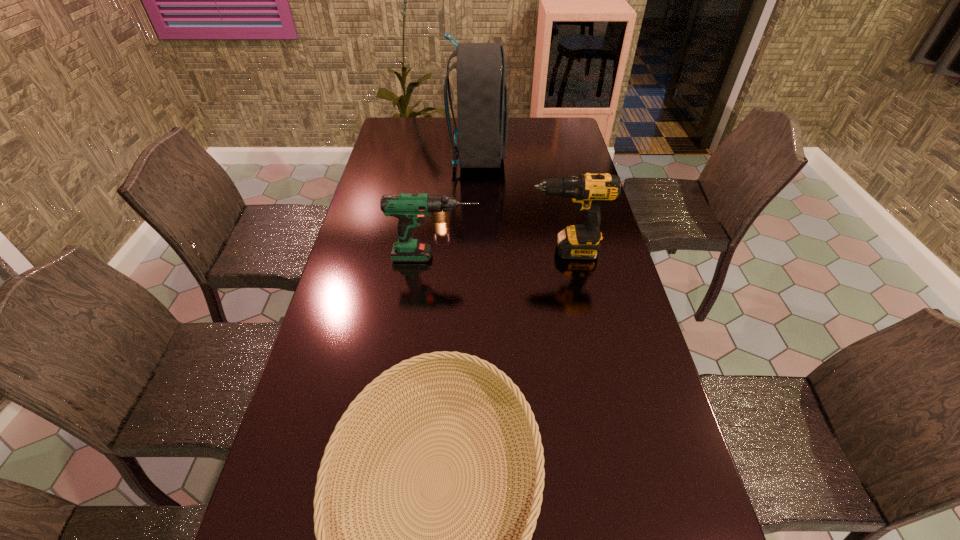
Where is `empty space that is in between the farthest object and the second farthest object`? The image size is (960, 540). empty space that is in between the farthest object and the second farthest object is located at coordinates (459, 189).

Select which object is the closest to the third tallest object. Please provide its 2D coordinates. Your answer should be formatted as a tuple, i.e. [(x, y)], where the tuple contains the x and y coordinates of a point satisfying the conditions above.

[(437, 217)]

You are a GUI agent. You are given a task and a screenshot of the screen. Output one action in this format:
    pyautogui.click(x=<x>, y=<y>)
    Task: Click on the object that is the closest to the backpack
    The height and width of the screenshot is (540, 960).
    Given the screenshot: What is the action you would take?
    pos(437,217)

You are a GUI agent. You are given a task and a screenshot of the screen. Output one action in this format:
    pyautogui.click(x=<x>, y=<y>)
    Task: Click on the vacant space that satisfies the following two spatial constraints: 1. on the front-facing side of the farthest object; 2. on the front-facing side of the padlock
    This screenshot has height=540, width=960.
    Given the screenshot: What is the action you would take?
    pyautogui.click(x=477, y=221)